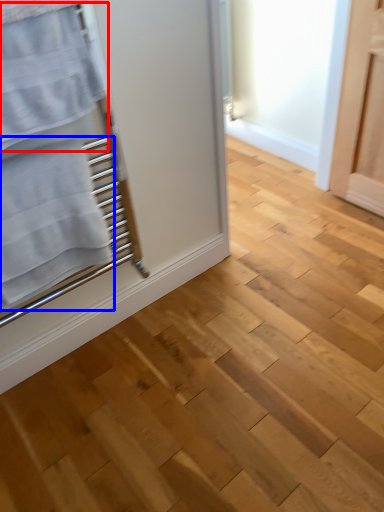
Question: Among these objects, which one is nearest to the camera, bath towel (highlighted by a red box) or bath towel (highlighted by a blue box)?

Choices:
 (A) bath towel
 (B) bath towel

Answer: (A)